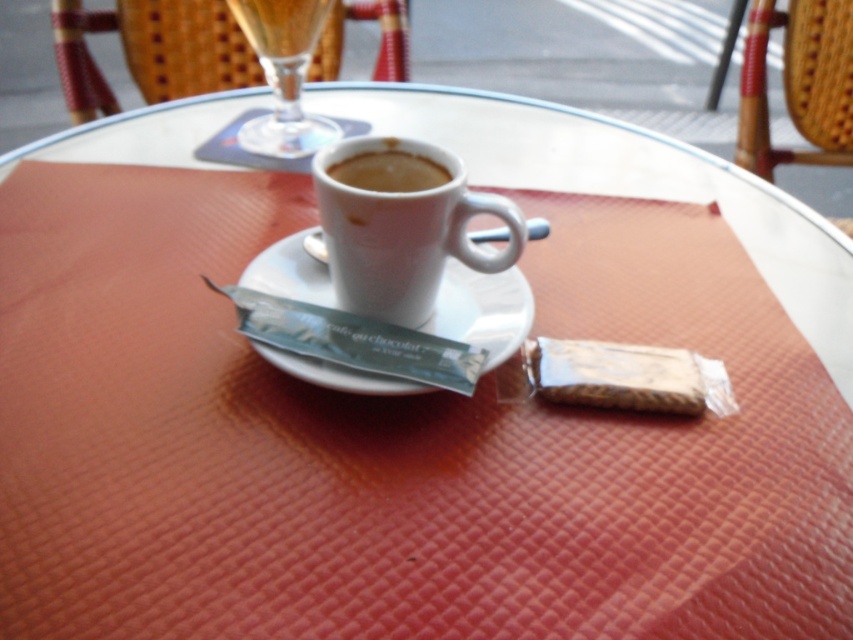
Question: Estimate the real-world distances between objects in this image. Which object is closer to the clear glass at upper center?

Choices:
 (A) white ceramic mug at center
 (B) white ceramic saucer at center
 (C) matte white cup at center

Answer: (B)

Question: Which is farther from the woven wicker chair at upper right?

Choices:
 (A) woven wood chair at upper left
 (B) clear glass at upper center
 (C) white ceramic mug at center
 (D) matte white cup at center

Answer: (D)

Question: Does white ceramic mug at center have a greater width compared to clear glass at upper center?

Choices:
 (A) yes
 (B) no

Answer: (A)

Question: Can you confirm if white ceramic mug at center is positioned above clear glass at upper center?

Choices:
 (A) yes
 (B) no

Answer: (B)

Question: Which of the following is the closest to the observer?

Choices:
 (A) (340, 220)
 (B) (389, 64)
 (C) (289, 368)
 (D) (264, 60)

Answer: (C)

Question: Is woven wood chair at upper left positioned in front of matte white cup at center?

Choices:
 (A) no
 (B) yes

Answer: (A)